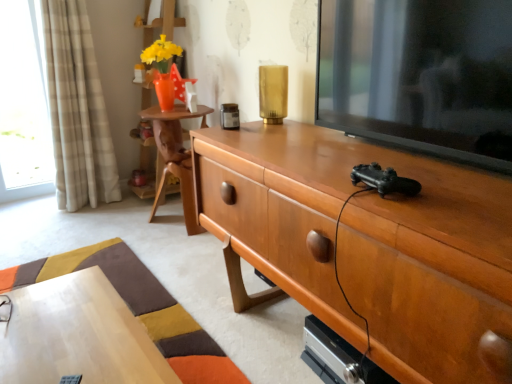
I want to click on woodenmaterial/texturebookshelf at upper left, so click(162, 23).

This screenshot has height=384, width=512. What do you see at coordinates (175, 157) in the screenshot?
I see `wooden side table at center` at bounding box center [175, 157].

Locate an element on the screen. The height and width of the screenshot is (384, 512). wooden side table at center is located at coordinates (175, 157).

What is the approximate height of black glossy television at right?

43.89 centimeters.

This screenshot has height=384, width=512. Describe the element at coordinates (368, 242) in the screenshot. I see `wooden cabinet at center` at that location.

Where is `woodenmaterial/texturebookshelf at upper left`? Image resolution: width=512 pixels, height=384 pixels. woodenmaterial/texturebookshelf at upper left is located at coordinates (162, 23).

From the image's perspective, which one is positioned higher, black glossy television at right or wooden cabinet at center?

black glossy television at right, from the image's perspective.

Is black glossy television at right aimed at wooden cabinet at center?

No, black glossy television at right is not aimed at wooden cabinet at center.

Would you say black glossy television at right is inside or outside wooden cabinet at center?

black glossy television at right is spatially situated outside wooden cabinet at center.

Is black glossy television at right beside wooden cabinet at center?

No, black glossy television at right is not making contact with wooden cabinet at center.

Between point (136, 366) and point (69, 203), which one is positioned in front?

The point (136, 366) is closer to the camera.

Is wooden desk at lower left far from beige plaid curtain at left?

Indeed, wooden desk at lower left is not near beige plaid curtain at left.

Which object is positioned more to the left, wooden desk at lower left or beige plaid curtain at left?

beige plaid curtain at left.

Is woodenmaterial/texturebookshelf at upper left far from wooden side table at center?

No, woodenmaterial/texturebookshelf at upper left is not far away from wooden side table at center.

Considering their positions, is woodenmaterial/texturebookshelf at upper left located in front of or behind wooden side table at center?

woodenmaterial/texturebookshelf at upper left is positioned farther from the viewer than wooden side table at center.

Image resolution: width=512 pixels, height=384 pixels. Identify the location of table lying on the right of woodenmaterial/texturebookshelf at upper left. (175, 157).

Does point (170, 3) come behind point (189, 161)?

Yes, it is behind point (189, 161).

Is woodenmaterial/texturebookshelf at upper left not near wooden desk at lower left?

Absolutely, woodenmaterial/texturebookshelf at upper left is distant from wooden desk at lower left.

Is woodenmaterial/texturebookshelf at upper left facing towards wooden desk at lower left?

No, woodenmaterial/texturebookshelf at upper left does not turn towards wooden desk at lower left.

Which is closer, (150, 191) or (23, 365)?

Point (150, 191) appears to be farther away from the viewer than point (23, 365).

From a real-world perspective, between woodenmaterial/texturebookshelf at upper left and wooden desk at lower left, who is vertically lower?

wooden desk at lower left is physically lower.

Is wooden side table at center not near wooden desk at lower left?

No, wooden side table at center is not far away from wooden desk at lower left.

Where is `table that appears above the wooden desk at lower left (from a real-world perspective)`? table that appears above the wooden desk at lower left (from a real-world perspective) is located at coordinates (175, 157).

In the scene shown: Considering the sizes of objects wooden side table at center and wooden desk at lower left in the image provided, who is shorter, wooden side table at center or wooden desk at lower left?

With less height is wooden desk at lower left.

From the image's perspective, is clear glass window at left below beige plaid curtain at left?

No, from the image's perspective, clear glass window at left is not beneath beige plaid curtain at left.

Is clear glass window at left looking in the opposite direction of beige plaid curtain at left?

No, beige plaid curtain at left is not at the back of clear glass window at left.

Is clear glass window at left with beige plaid curtain at left?

They are not placed beside each other.

Considering the points (44, 93) and (51, 56), which point is in front, point (44, 93) or point (51, 56)?

The point (51, 56) is closer to the camera.

Is beige plaid curtain at left positioned beyond the bounds of woodenmaterial/texturebookshelf at upper left?

Yes.

Considering the sizes of objects beige plaid curtain at left and woodenmaterial/texturebookshelf at upper left in the image provided, who is smaller, beige plaid curtain at left or woodenmaterial/texturebookshelf at upper left?

With smaller size is beige plaid curtain at left.

Can you confirm if beige plaid curtain at left is wider than woodenmaterial/texturebookshelf at upper left?

Incorrect, the width of beige plaid curtain at left does not surpass that of woodenmaterial/texturebookshelf at upper left.

Considering the relative positions of beige plaid curtain at left and woodenmaterial/texturebookshelf at upper left in the image provided, is beige plaid curtain at left behind woodenmaterial/texturebookshelf at upper left?

No, beige plaid curtain at left is closer to the camera.

Where is `television that is above the wooden cabinet at center (from a real-world perspective)`? This screenshot has width=512, height=384. television that is above the wooden cabinet at center (from a real-world perspective) is located at coordinates (420, 74).

At what (x,y) coordinates should I click in order to perform the action: click on curtain behind the wooden desk at lower left. Please return your answer as a coordinate pair (x, y). The width and height of the screenshot is (512, 384). Looking at the image, I should click on (77, 109).

From the image, which object appears to be nearer to clear glass window at left, wooden cabinet at center or wooden desk at lower left?

The object closer to clear glass window at left is wooden desk at lower left.

Which object lies nearer to the anchor point woodenmaterial/texturebookshelf at upper left, black glossy television at right or wooden side table at center?

The object closer to woodenmaterial/texturebookshelf at upper left is wooden side table at center.

Estimate the real-world distances between objects in this image. Which object is closer to wooden side table at center, clear glass window at left or wooden desk at lower left?

wooden desk at lower left.

Considering their positions, is wooden side table at center positioned closer to wooden cabinet at center than beige plaid curtain at left?

The object closer to wooden cabinet at center is wooden side table at center.

Based on their spatial positions, is clear glass window at left or wooden desk at lower left closer to black glossy television at right?

Based on the image, wooden desk at lower left appears to be nearer to black glossy television at right.

In the scene shown: Estimate the real-world distances between objects in this image. Which object is further from beige plaid curtain at left, clear glass window at left or wooden side table at center?

wooden side table at center.

Considering their positions, is wooden desk at lower left positioned closer to wooden side table at center than beige plaid curtain at left?

beige plaid curtain at left lies closer to wooden side table at center than the other object.

Which object lies nearer to the anchor point wooden desk at lower left, beige plaid curtain at left or wooden cabinet at center?

wooden cabinet at center is positioned closer to the anchor wooden desk at lower left.

Where is `cabinetry between beige plaid curtain at left and black glossy television at right`? cabinetry between beige plaid curtain at left and black glossy television at right is located at coordinates (368, 242).

Image resolution: width=512 pixels, height=384 pixels. I want to click on curtain between clear glass window at left and wooden side table at center, so click(77, 109).

You are a GUI agent. You are given a task and a screenshot of the screen. Output one action in this format:
    pyautogui.click(x=<x>, y=<y>)
    Task: Click on the table between wooden cabinet at center and beige plaid curtain at left along the z-axis
    
    Given the screenshot: What is the action you would take?
    pyautogui.click(x=175, y=157)

Find the location of `cabinetry situated between clear glass window at left and black glossy television at right from left to right`. cabinetry situated between clear glass window at left and black glossy television at right from left to right is located at coordinates (368, 242).